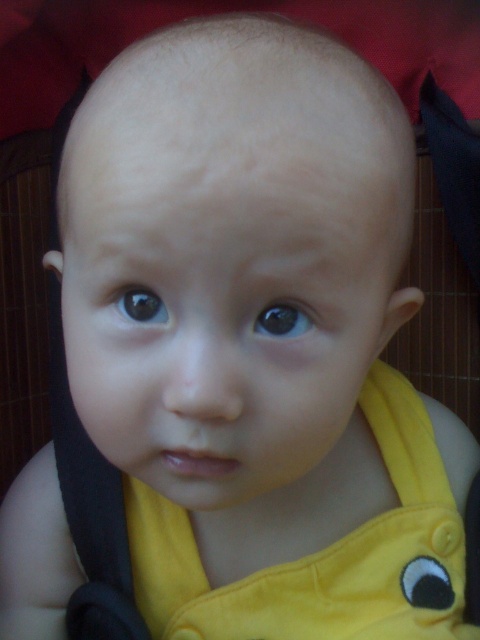
Find the location of a particular element. brown glossy eye at center is located at coordinates (283, 321).

Based on the photo, can you confirm if brown glossy eye at center is positioned below black glossy eye at center?

Yes, brown glossy eye at center is below black glossy eye at center.

Is point (298, 333) behind point (129, 308)?

No, it is in front of (129, 308).

Identify the location of brown glossy eye at center. (283, 321).